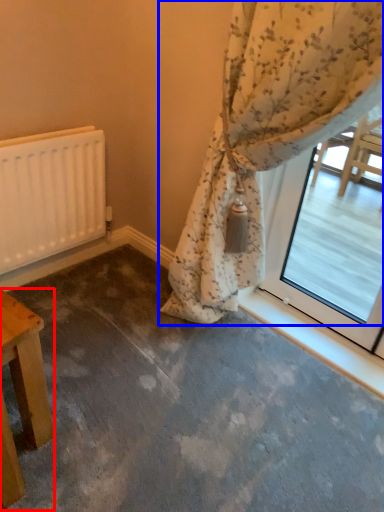
Question: Which object is further to the camera taking this photo, table (highlighted by a red box) or curtain (highlighted by a blue box)?

Choices:
 (A) table
 (B) curtain

Answer: (A)